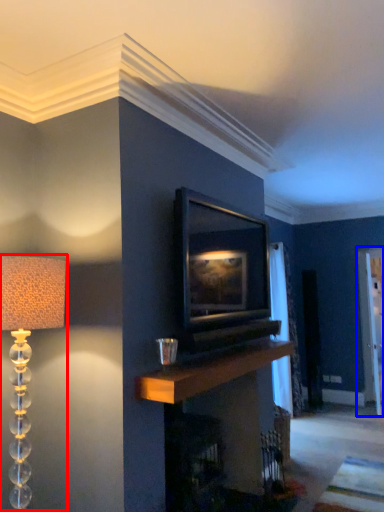
Question: Which point is closer to the camera, lamp (highlighted by a red box) or glass door (highlighted by a blue box)?

Choices:
 (A) lamp
 (B) glass door

Answer: (A)